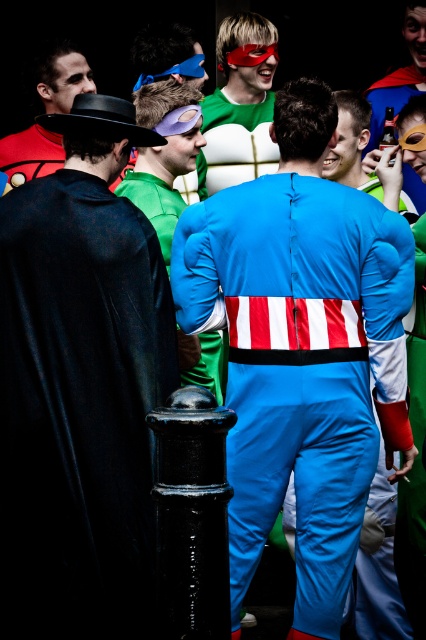
Question: Does blue spandex suit at center appear on the right side of black velvet cape at left?

Choices:
 (A) no
 (B) yes

Answer: (B)

Question: Can you confirm if blue spandex suit at center is positioned above black velvet cape at left?

Choices:
 (A) yes
 (B) no

Answer: (A)

Question: In this image, where is black velvet cape at left located relative to green fabric mask at upper center?

Choices:
 (A) above
 (B) below

Answer: (B)

Question: Estimate the real-world distances between objects in this image. Which object is farther from the green fabric mask at upper center?

Choices:
 (A) matte black mask at upper left
 (B) matte blue costume at center

Answer: (B)

Question: Which point is closer to the camera taking this photo?

Choices:
 (A) (256, 120)
 (B) (357, 179)

Answer: (B)

Question: Which object is positioned farthest from the black velvet cape at left?

Choices:
 (A) blue spandex suit at center
 (B) matte blue costume at center
 (C) matte black mask at upper left

Answer: (C)